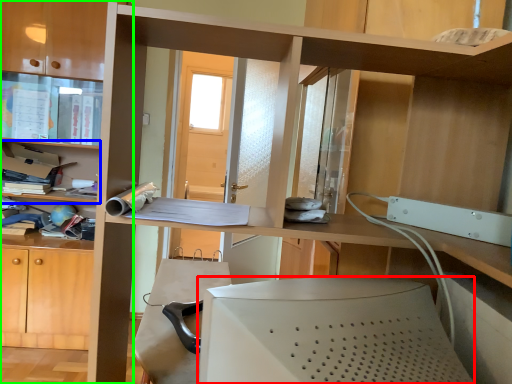
Question: Considering the real-world distances, which object is farthest from desktop computer (highlighted by a red box)? shelf (highlighted by a blue box) or bookcase (highlighted by a green box)?

Choices:
 (A) shelf
 (B) bookcase

Answer: (A)